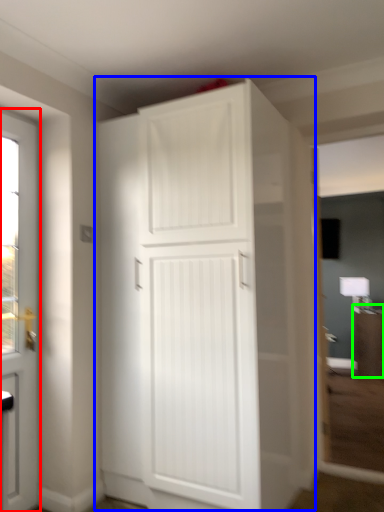
Question: Based on their relative distances, which object is nearer to door (highlighted by a red box)? Choose from cupboard (highlighted by a blue box) and cabinetry (highlighted by a green box).

Choices:
 (A) cupboard
 (B) cabinetry

Answer: (A)